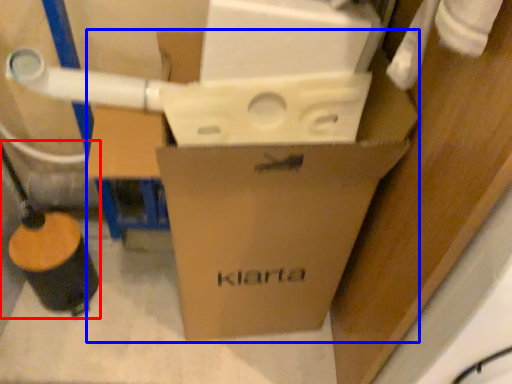
Question: Among these objects, which one is farthest to the camera, water pipe (highlighted by a red box) or box (highlighted by a blue box)?

Choices:
 (A) water pipe
 (B) box

Answer: (A)